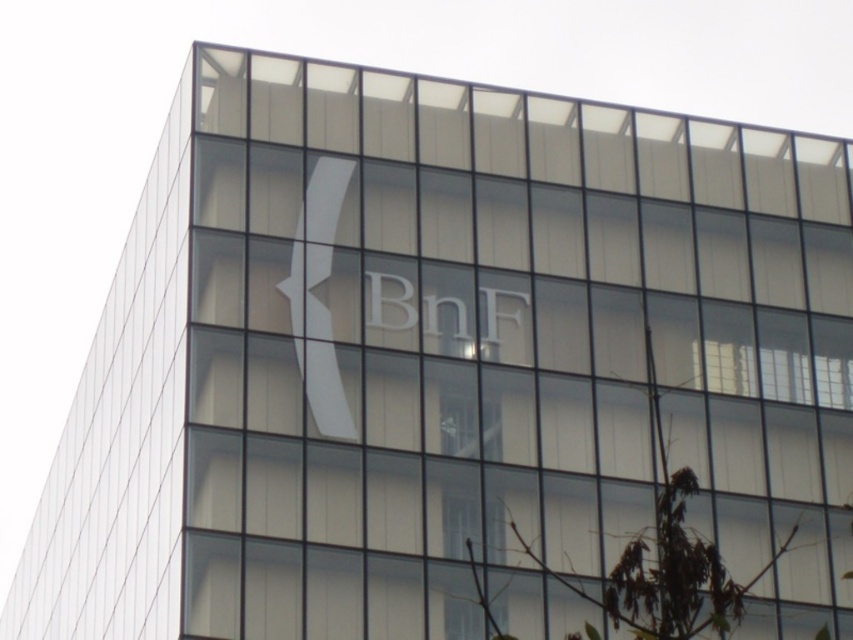
You are an architect designing a new building and want to ensure the logo is more prominent than the window. Based on the scene, does the white glass logo at center appear wider than the transparent glass window at center?

The white glass logo at center is wider than the transparent glass window at center, so yes, it appears more prominent in width.

You are an architect reviewing the design of the building facade. You notice the white glass logo at center and the transparent glass window at center. According to the design specifications, which object is positioned to the left?

The white glass logo at center is positioned to the left of the transparent glass window at center.